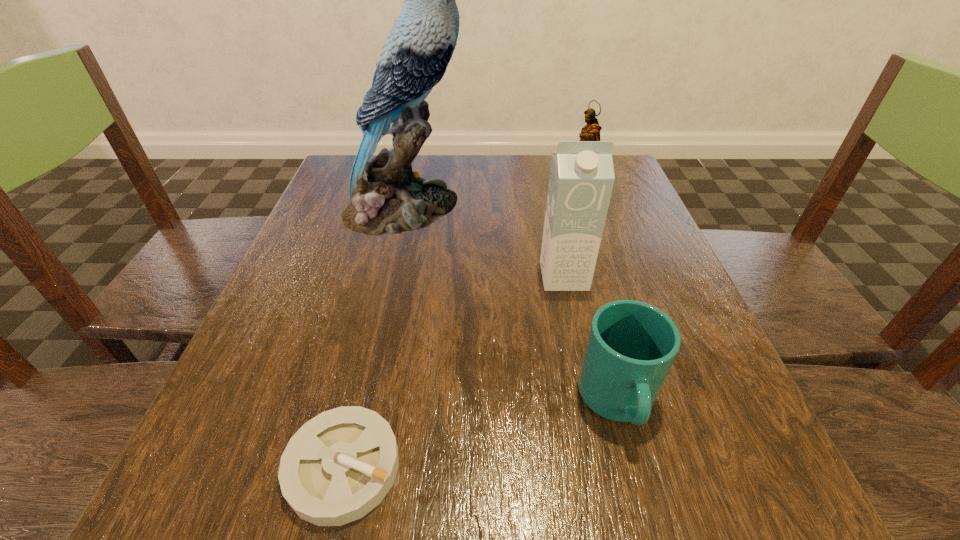
Locate an element on the screen. This screenshot has width=960, height=540. parakeet is located at coordinates [x=387, y=197].

What are the coordinates of `the third farthest object` in the screenshot? It's located at (581, 180).

Find the location of a particular element. The height and width of the screenshot is (540, 960). the second tallest object is located at coordinates (581, 180).

Find the location of a particular element. This screenshot has width=960, height=540. the third tallest object is located at coordinates (591, 132).

The image size is (960, 540). I want to click on the fourth tallest object, so click(x=631, y=346).

I want to click on the shortest object, so click(338, 466).

You are a GUI agent. You are given a task and a screenshot of the screen. Output one action in this format:
    pyautogui.click(x=<x>, y=<y>)
    Task: Click on the free space located 0.150m on the face of the tallest object
    
    Given the screenshot: What is the action you would take?
    pyautogui.click(x=531, y=208)

You are a GUI agent. You are given a task and a screenshot of the screen. Output one action in this format:
    pyautogui.click(x=<x>, y=<y>)
    Task: Click on the vacant space located on the front label of the third nearest object
    
    Given the screenshot: What is the action you would take?
    pyautogui.click(x=580, y=353)

This screenshot has height=540, width=960. Find the location of `vacant space located 0.300m on the front-facing side of the figurine`. vacant space located 0.300m on the front-facing side of the figurine is located at coordinates (422, 200).

Locate an element on the screen. The height and width of the screenshot is (540, 960). vacant point located 0.140m on the front-facing side of the figurine is located at coordinates (492, 200).